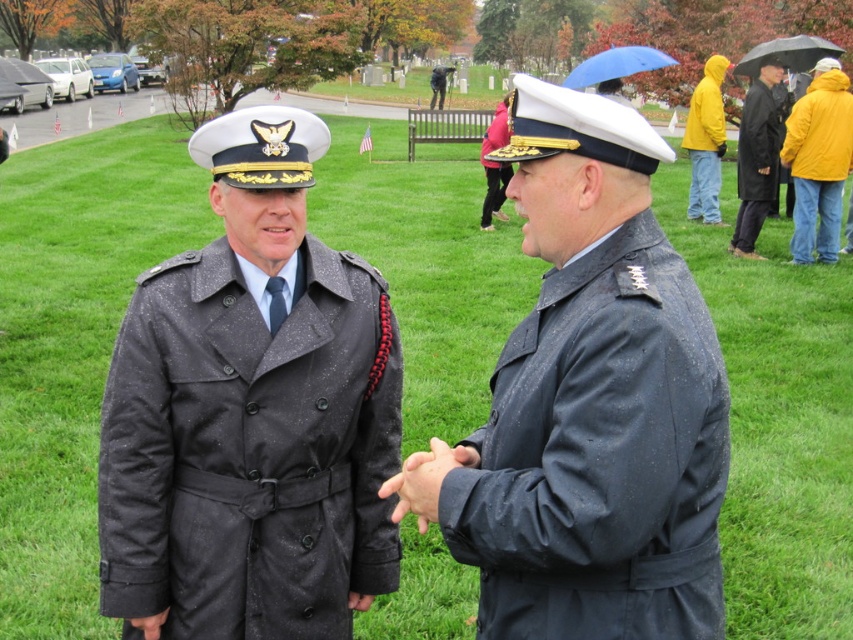
You are a photographer trying to capture a clear shot of the two individuals in the scene. Since both are wearing similar dark colors, you need to adjust your camera focus to distinguish between the matte black trench coat at center and the matte black uniform at center. Based on their spatial relationship, which one should you focus on first to ensure it appears sharp in the photo?

The matte black trench coat at center is above the matte black uniform at center, so focusing on the matte black trench coat at center first will ensure it appears sharp in the photo.

You are a tailor who needs to determine which item requires more fabric to make between the matte black uniform at center and the black leather coat at right. Which one would need more fabric?

The black leather coat at right requires more fabric because it is thicker than the matte black uniform at center.

You are a photographer positioned at the point with coordinates [251,413] in the image. You want to capture a closeup of the matte black trench coat at center. Is your current position directly on the matte black trench coat at center?

Yes, the point at coordinates [251,413] corresponds to the matte black trench coat at center, so your current position is directly on it.